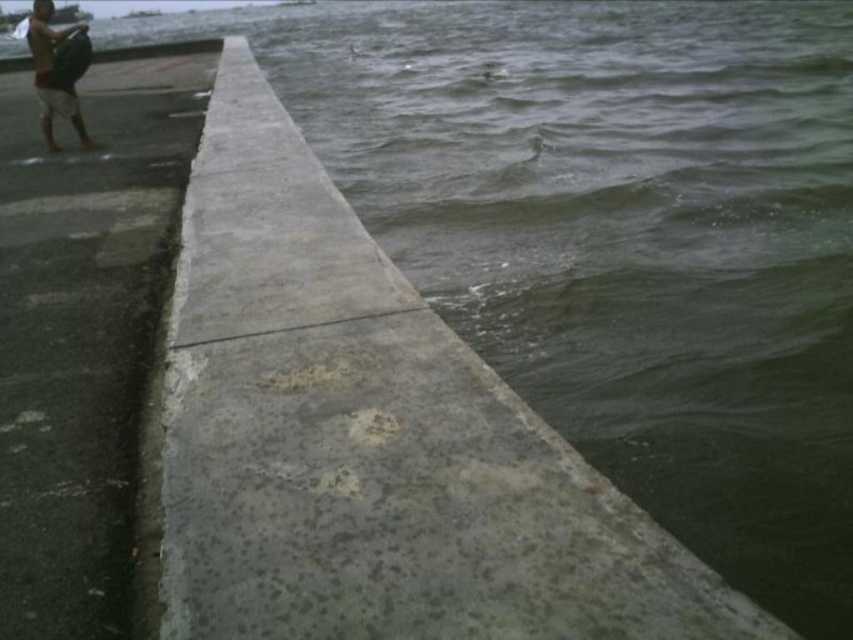
Is gray concrete at center closer to camera compared to tan skin human at upper left?

That is True.

Who is more forward, (x=190, y=440) or (x=56, y=102)?

Point (x=190, y=440)

Where is `gray concrete at center`? The width and height of the screenshot is (853, 640). gray concrete at center is located at coordinates (370, 440).

Who is lower down, gray concrete at center or gray concrete pavement at left?

gray concrete at center

Which is more to the left, gray concrete at center or gray concrete pavement at left?

Positioned to the left is gray concrete pavement at left.

Locate an element on the screen. gray concrete at center is located at coordinates (370, 440).

From the picture: Which is more to the right, gray concrete pavement at left or tan skin human at upper left?

From the viewer's perspective, gray concrete pavement at left appears more on the right side.

Does gray concrete pavement at left have a greater width compared to tan skin human at upper left?

Yes.

The image size is (853, 640). Describe the element at coordinates (86, 332) in the screenshot. I see `gray concrete pavement at left` at that location.

The width and height of the screenshot is (853, 640). I want to click on gray concrete pavement at left, so click(x=86, y=332).